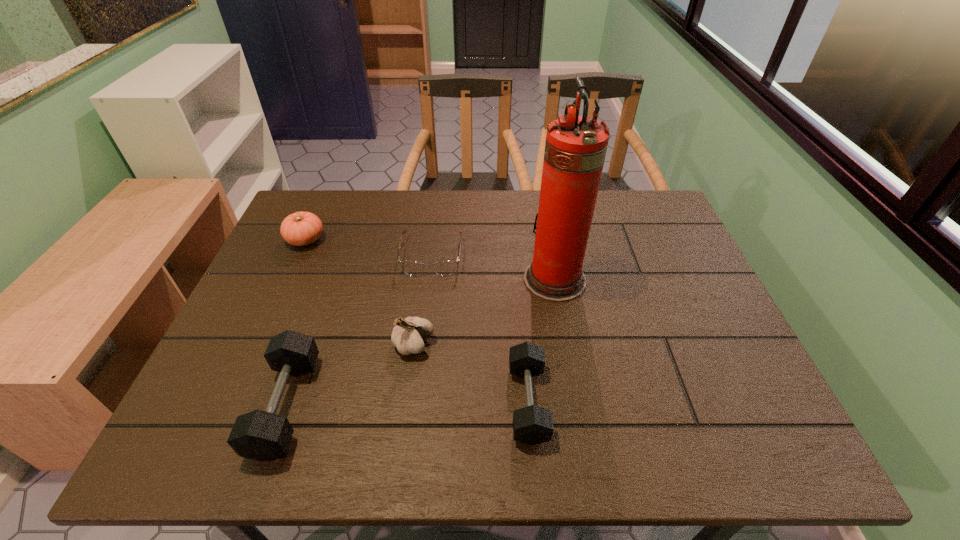
Where is `the fifth object from right to left`? The width and height of the screenshot is (960, 540). the fifth object from right to left is located at coordinates (260, 435).

Image resolution: width=960 pixels, height=540 pixels. I want to click on the left dumbbell, so click(260, 435).

The height and width of the screenshot is (540, 960). In order to click on the shorter dumbbell in this screenshot , I will do `click(532, 425)`.

At what (x,y) coordinates should I click in order to perform the action: click on spectacles. Please return your answer as a coordinate pair (x, y). This screenshot has width=960, height=540. Looking at the image, I should click on (444, 268).

Where is `tomato`? This screenshot has width=960, height=540. tomato is located at coordinates (301, 228).

Find the location of `garlic`. garlic is located at coordinates (408, 335).

Where is `the tallest object`? This screenshot has width=960, height=540. the tallest object is located at coordinates (575, 149).

This screenshot has width=960, height=540. What are the coordinates of `vacant region located on the right of the fifth object from right to left` in the screenshot? It's located at (395, 405).

Where is `free space located on the left of the right dumbbell`? The image size is (960, 540). free space located on the left of the right dumbbell is located at coordinates (381, 402).

You are a GUI agent. You are given a task and a screenshot of the screen. Output one action in this format:
    pyautogui.click(x=<x>, y=<y>)
    Task: Click on the vacant area located 0.280m on the front-facing side of the shortest object
    
    Given the screenshot: What is the action you would take?
    pyautogui.click(x=419, y=364)